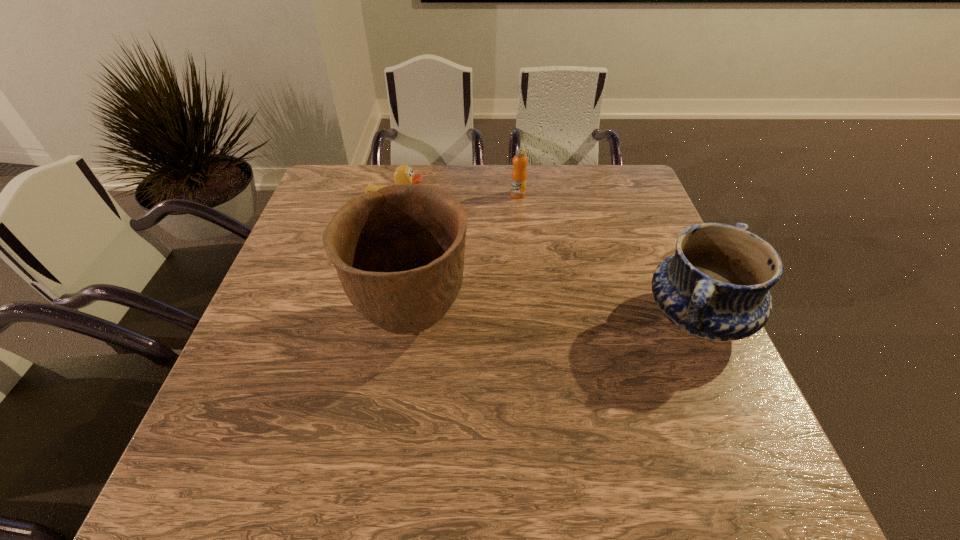
The height and width of the screenshot is (540, 960). What are the coordinates of `free space on the desktop that is between the tallest object and the third shortest object and is positioned on the front label of the farthest object` in the screenshot? It's located at (526, 320).

The height and width of the screenshot is (540, 960). What are the coordinates of `vacant spot on the desktop that is between the taller pottery and the rightmost object and is positioned at the beak of the second farthest object` in the screenshot? It's located at (527, 320).